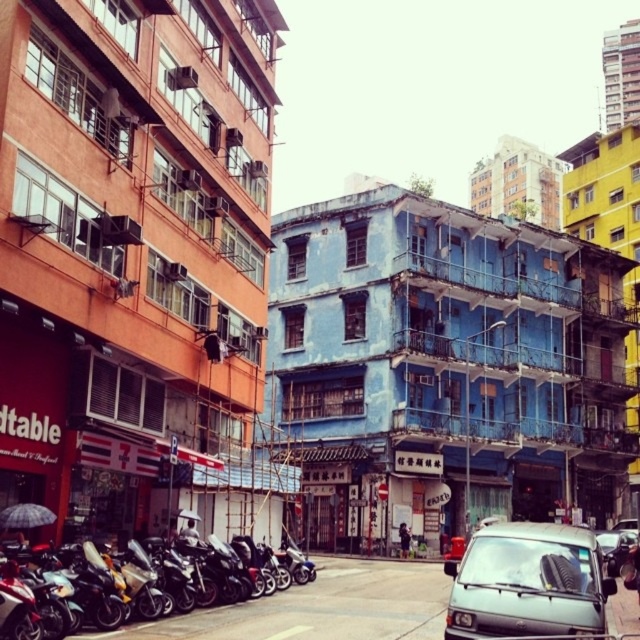
Does silver metallic van at lower right appear on the left side of metallic silver van at lower right?

Indeed, silver metallic van at lower right is positioned on the left side of metallic silver van at lower right.

Which of these two, silver metallic van at lower right or metallic silver van at lower right, stands shorter?

metallic silver van at lower right is shorter.

The height and width of the screenshot is (640, 640). Identify the location of silver metallic van at lower right. (528, 582).